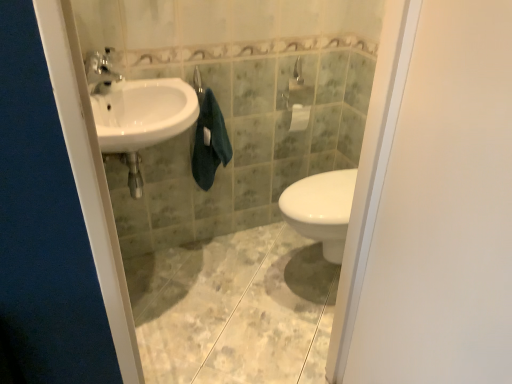
Question: Is matte silver faucet at upper left situated inside white matte screen door at right or outside?

Choices:
 (A) inside
 (B) outside

Answer: (B)

Question: Is matte silver faucet at upper left to the left or to the right of white matte screen door at right in the image?

Choices:
 (A) right
 (B) left

Answer: (B)

Question: Considering the real-world distances, which object is closest to the white matte screen door at right?

Choices:
 (A) white glossy sink at left
 (B) dark green towel at center
 (C) matte silver faucet at upper left

Answer: (A)

Question: Considering the real-world distances, which object is closest to the white matte screen door at right?

Choices:
 (A) matte silver faucet at upper left
 (B) dark green towel at center
 (C) white glossy sink at left

Answer: (C)